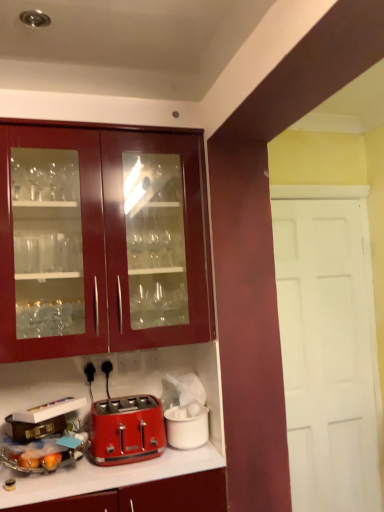
Question: Is the depth of brown leather suitcase at lower left, placed as the 3th appliance when sorted from right to left, less than that of matte red toaster at lower left, which is the second appliance from right to left?

Choices:
 (A) yes
 (B) no

Answer: (B)

Question: Is brown leather suitcase at lower left, the first appliance from the left, further to the viewer compared to matte red toaster at lower left, which is counted as the second appliance, starting from the left?

Choices:
 (A) no
 (B) yes

Answer: (B)

Question: Is brown leather suitcase at lower left, placed as the 3th appliance when sorted from right to left, far from matte red toaster at lower left, which is the second appliance from right to left?

Choices:
 (A) no
 (B) yes

Answer: (A)

Question: Is brown leather suitcase at lower left, the first appliance from the left, oriented towards matte red toaster at lower left, which is counted as the second appliance, starting from the left?

Choices:
 (A) no
 (B) yes

Answer: (A)

Question: Can we say brown leather suitcase at lower left, the first appliance from the left, lies outside matte red toaster at lower left, which is the second appliance from right to left?

Choices:
 (A) yes
 (B) no

Answer: (A)

Question: Is matte red toaster at lower left, which is the second appliance from right to left, surrounded by brown leather suitcase at lower left, placed as the 3th appliance when sorted from right to left?

Choices:
 (A) yes
 (B) no

Answer: (B)

Question: Is shiny red toaster at lower center taller than white matte ice bucket at lower center, which ranks as the 1th appliance in right-to-left order?

Choices:
 (A) no
 (B) yes

Answer: (B)

Question: Does shiny red toaster at lower center touch white matte ice bucket at lower center, which ranks as the 1th appliance in right-to-left order?

Choices:
 (A) no
 (B) yes

Answer: (A)

Question: Is shiny red toaster at lower center positioned with its back to white matte ice bucket at lower center, which appears as the third appliance when viewed from the left?

Choices:
 (A) no
 (B) yes

Answer: (A)

Question: Does shiny red toaster at lower center lie behind white matte ice bucket at lower center, which ranks as the 1th appliance in right-to-left order?

Choices:
 (A) no
 (B) yes

Answer: (A)

Question: Is white matte ice bucket at lower center, which ranks as the 1th appliance in right-to-left order, a part of shiny red toaster at lower center?

Choices:
 (A) no
 (B) yes

Answer: (A)

Question: Considering the relative sizes of shiny red toaster at lower center and white matte ice bucket at lower center, which appears as the third appliance when viewed from the left, in the image provided, is shiny red toaster at lower center shorter than white matte ice bucket at lower center, which appears as the third appliance when viewed from the left,?

Choices:
 (A) yes
 (B) no

Answer: (B)

Question: From the image's perspective, is matte red toaster at lower left, which is counted as the second appliance, starting from the left, located above brown leather suitcase at lower left, the first appliance from the left?

Choices:
 (A) yes
 (B) no

Answer: (B)